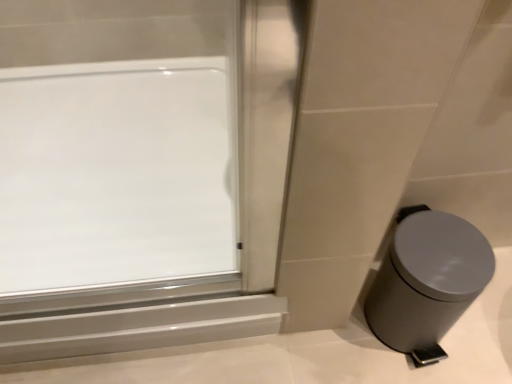
Where is `transparent glass window at upper left`? transparent glass window at upper left is located at coordinates (112, 142).

Image resolution: width=512 pixels, height=384 pixels. What do you see at coordinates (112, 142) in the screenshot?
I see `transparent glass window at upper left` at bounding box center [112, 142].

Measure the distance between point (112, 184) and camera.

The distance of point (112, 184) from camera is 37.76 inches.

In order to face gray matte waste container at lower right, should I rotate leftwards or rightwards?

Turn right by 21.913 degrees to look at gray matte waste container at lower right.

Find the location of `gray matte waste container at lower right`. gray matte waste container at lower right is located at coordinates (426, 281).

Measure the distance between point (x=403, y=319) and camera.

The depth of point (x=403, y=319) is 77.20 centimeters.

Measure the distance between gray matte waste container at lower right and camera.

gray matte waste container at lower right is 26.82 inches from camera.

The height and width of the screenshot is (384, 512). What do you see at coordinates (426, 281) in the screenshot?
I see `gray matte waste container at lower right` at bounding box center [426, 281].

Find the location of a particular element. transparent glass window at upper left is located at coordinates (112, 142).

Can you confirm if gray matte waste container at lower right is positioned to the right of transparent glass window at upper left?

Indeed, gray matte waste container at lower right is positioned on the right side of transparent glass window at upper left.

Is gray matte waste container at lower right further to the viewer compared to transparent glass window at upper left?

No, it is not.

Which point is more distant from viewer, (486,239) or (45,138)?

The point (45,138) is farther from the camera.

From the image's perspective, which one is positioned higher, gray matte waste container at lower right or transparent glass window at upper left?

transparent glass window at upper left.

From a real-world perspective, which is physically below, gray matte waste container at lower right or transparent glass window at upper left?

gray matte waste container at lower right, from a real-world perspective.

Can you confirm if gray matte waste container at lower right is wider than transparent glass window at upper left?

In fact, gray matte waste container at lower right might be narrower than transparent glass window at upper left.

Which of these two, gray matte waste container at lower right or transparent glass window at upper left, stands shorter?

transparent glass window at upper left.

From the picture: Does gray matte waste container at lower right have a larger size compared to transparent glass window at upper left?

No, gray matte waste container at lower right is not bigger than transparent glass window at upper left.

Is gray matte waste container at lower right positioned beyond the bounds of transparent glass window at upper left?

gray matte waste container at lower right lies outside transparent glass window at upper left's area.

Can you see gray matte waste container at lower right touching transparent glass window at upper left?

No, gray matte waste container at lower right is not in contact with transparent glass window at upper left.

Is gray matte waste container at lower right facing away from transparent glass window at upper left?

No, gray matte waste container at lower right is not facing away from transparent glass window at upper left.

Identify the location of waste container on the right of the transparent glass window at upper left. The height and width of the screenshot is (384, 512). (426, 281).

In the image, is transparent glass window at upper left on the left side or the right side of gray matte waste container at lower right?

Clearly, transparent glass window at upper left is on the left of gray matte waste container at lower right in the image.

Consider the image. Does transparent glass window at upper left lie behind gray matte waste container at lower right?

Yes.

Does point (69, 175) lie in front of point (492, 271)?

No, it is behind (492, 271).

From the image's perspective, between transparent glass window at upper left and gray matte waste container at lower right, who is located below?

gray matte waste container at lower right is shown below in the image.

From a real-world perspective, between transparent glass window at upper left and gray matte waste container at lower right, who is vertically higher?

transparent glass window at upper left, from a real-world perspective.

Considering the sizes of objects transparent glass window at upper left and gray matte waste container at lower right in the image provided, who is thinner, transparent glass window at upper left or gray matte waste container at lower right?

gray matte waste container at lower right.

Does transparent glass window at upper left have a greater height compared to gray matte waste container at lower right?

Incorrect, the height of transparent glass window at upper left is not larger of that of gray matte waste container at lower right.

Is transparent glass window at upper left bigger or smaller than gray matte waste container at lower right?

transparent glass window at upper left is bigger than gray matte waste container at lower right.

Can we say transparent glass window at upper left lies outside gray matte waste container at lower right?

Yes, transparent glass window at upper left is outside of gray matte waste container at lower right.

Is transparent glass window at upper left next to gray matte waste container at lower right?

No, transparent glass window at upper left is not beside gray matte waste container at lower right.

Is transparent glass window at upper left oriented towards gray matte waste container at lower right?

No, transparent glass window at upper left is not aimed at gray matte waste container at lower right.

How different are the orientations of transparent glass window at upper left and gray matte waste container at lower right in degrees?

The facing directions of transparent glass window at upper left and gray matte waste container at lower right are 0.253 degrees apart.

The image size is (512, 384). I want to click on window located behind the gray matte waste container at lower right, so click(x=112, y=142).

What are the coordinates of `window above the gray matte waste container at lower right (from a real-world perspective)` in the screenshot? It's located at (112, 142).

Image resolution: width=512 pixels, height=384 pixels. Identify the location of window to the left of gray matte waste container at lower right. (112, 142).